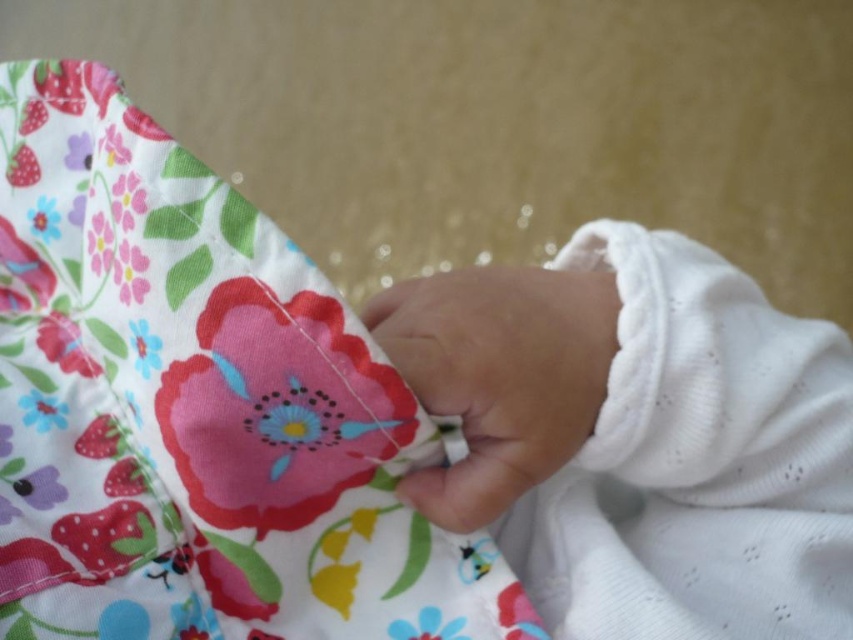
Does white soft fabric at center have a greater height compared to smooth white hand at center?

Correct, white soft fabric at center is much taller as smooth white hand at center.

Is white soft fabric at center closer to camera compared to smooth white hand at center?

No, it is not.

Who is more forward, (621,531) or (495,509)?

Positioned in front is point (495,509).

Locate an element on the screen. The height and width of the screenshot is (640, 853). white soft fabric at center is located at coordinates (695, 461).

Can you confirm if floral fabric at center is bigger than white soft fabric at center?

Yes.

Who is shorter, floral fabric at center or white soft fabric at center?

With less height is white soft fabric at center.

This screenshot has height=640, width=853. Describe the element at coordinates (196, 408) in the screenshot. I see `floral fabric at center` at that location.

You are a GUI agent. You are given a task and a screenshot of the screen. Output one action in this format:
    pyautogui.click(x=<x>, y=<y>)
    Task: Click on the floral fabric at center
    
    Given the screenshot: What is the action you would take?
    pyautogui.click(x=196, y=408)

Can you confirm if floral fabric at center is positioned below smooth white hand at center?

Yes, floral fabric at center is below smooth white hand at center.

Between floral fabric at center and smooth white hand at center, which one is positioned higher?

smooth white hand at center

The image size is (853, 640). Describe the element at coordinates (196, 408) in the screenshot. I see `floral fabric at center` at that location.

The width and height of the screenshot is (853, 640). I want to click on floral fabric at center, so click(x=196, y=408).